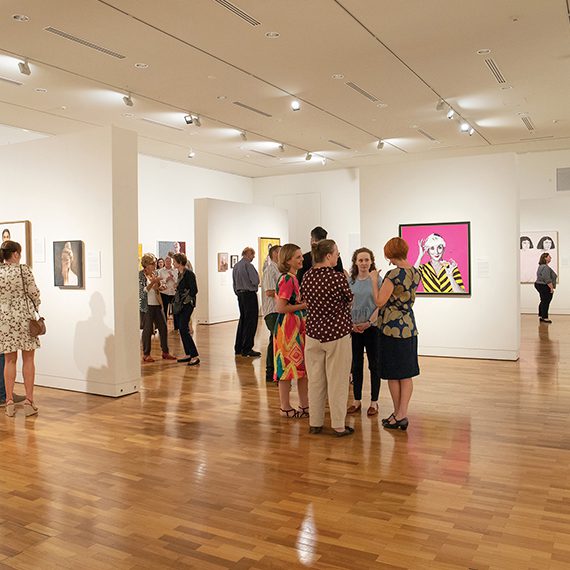
This screenshot has width=570, height=570. Identify the location of light. (470, 134).